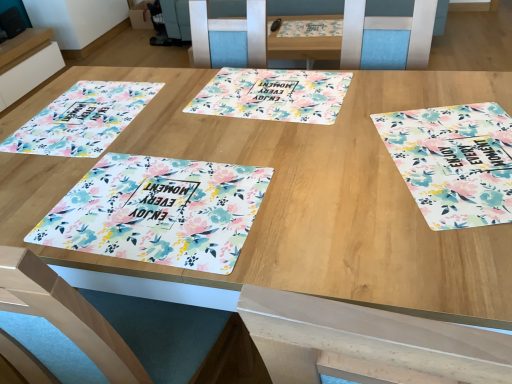
Locate an element on the screen. This screenshot has width=512, height=384. free space between floral printed placemat at left, arranged as the 3th tablecloth when viewed from the right, and floral printed placemat at lower left, the 2th tablecloth when ordered from left to right is located at coordinates (142, 147).